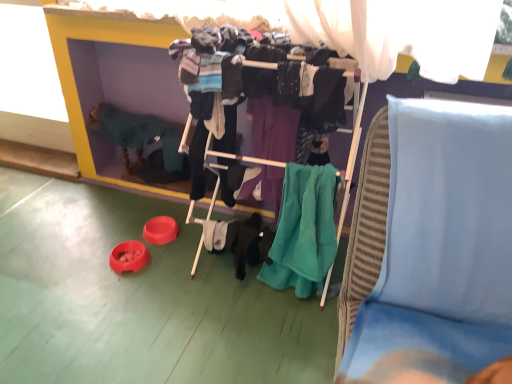
Image resolution: width=512 pixels, height=384 pixels. I want to click on vacant point above teal fabric clothes at center (from a real-world perspective), so click(x=286, y=48).